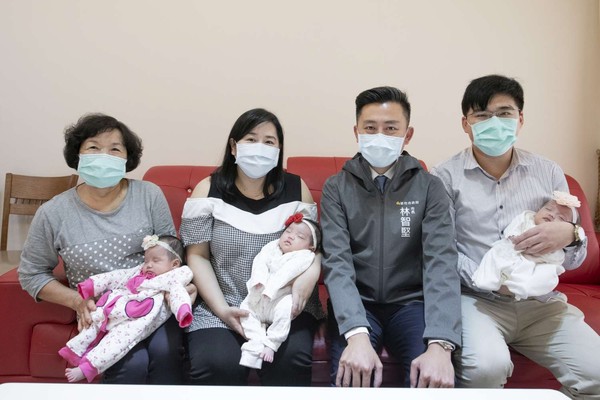
Locate an element on the screen. This screenshot has height=400, width=600. wall is located at coordinates (181, 90).